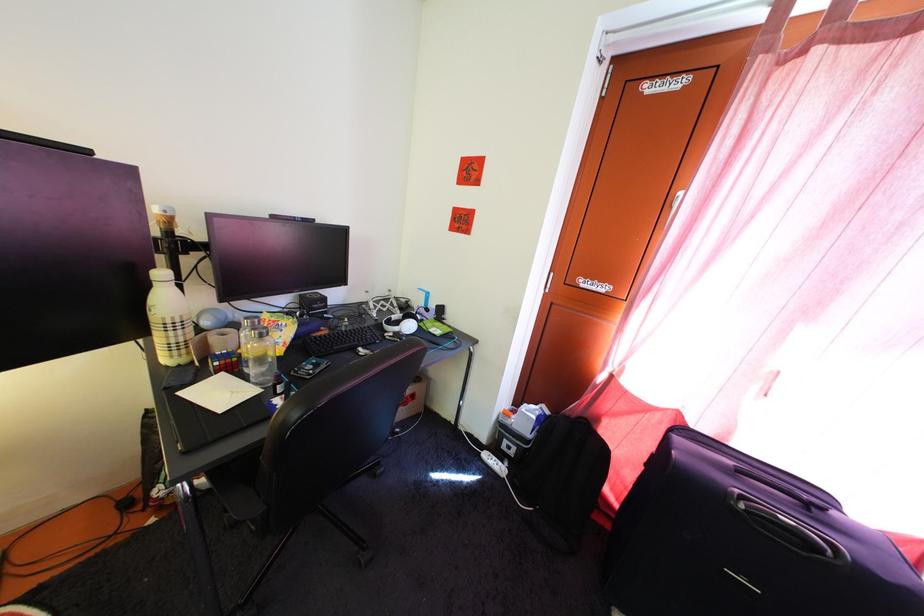
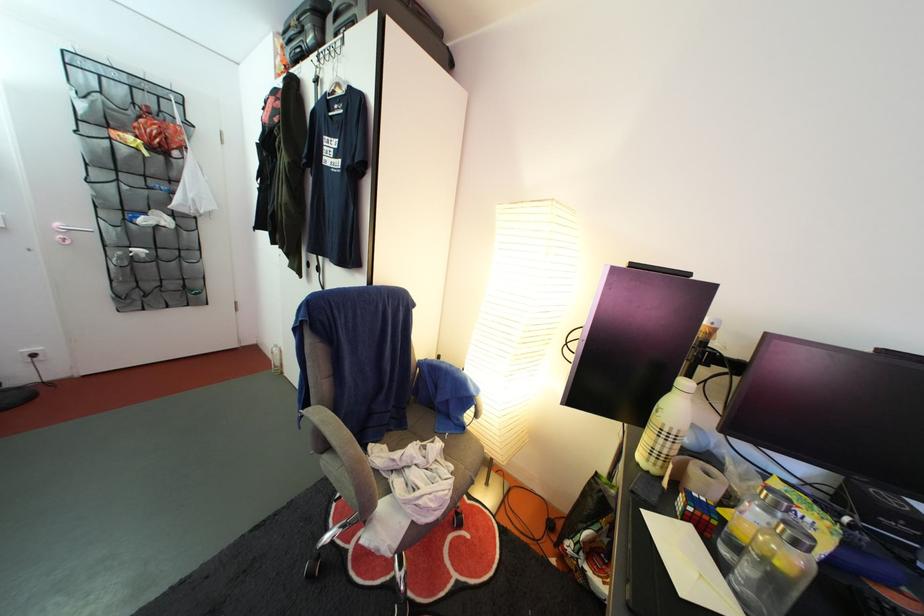
Question: The camera is either moving clockwise (left) or counter-clockwise (right) around the object. The first image is from the beginning of the video and the second image is from the end. Is the camera moving left or right when shooting the video?

Choices:
 (A) Left
 (B) Right

Answer: (B)